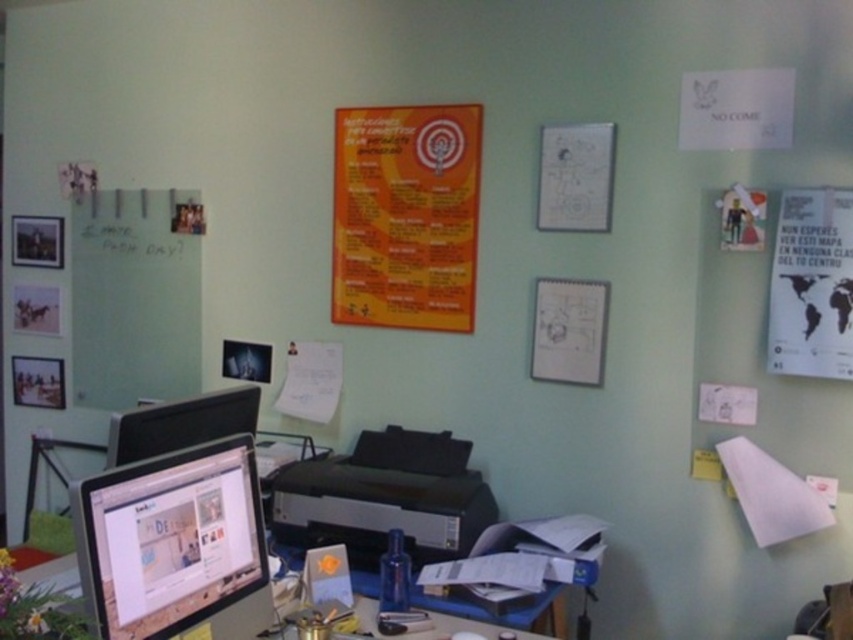
Question: Can you confirm if orange paper poster at upper center is positioned to the right of matte black monitor at lower left?

Choices:
 (A) yes
 (B) no

Answer: (A)

Question: Does black plastic printer at center appear under matte black monitor at lower left?

Choices:
 (A) yes
 (B) no

Answer: (A)

Question: Which point is closer to the camera taking this photo?

Choices:
 (A) (579, 323)
 (B) (564, 604)
 (C) (202, 420)
 (D) (160, 541)

Answer: (D)

Question: Considering the real-world distances, which object is closest to the blue plastic table at lower center?

Choices:
 (A) orange paper poster at upper center
 (B) matte black monitor at lower left
 (C) white paper at center

Answer: (B)

Question: Which object is the closest to the orange paper poster at upper center?

Choices:
 (A) blue plastic table at lower center
 (B) white paper at center
 (C) black plastic printer at center

Answer: (B)

Question: Is white matte dry erase board at left above white paper at center?

Choices:
 (A) yes
 (B) no

Answer: (A)